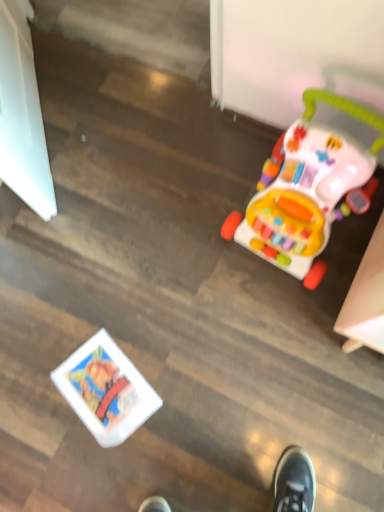
This screenshot has height=512, width=384. I want to click on vacant space in front of multicolored plastic walker at right, which ranks as the 2th toy in left-to-right order, so click(x=290, y=327).